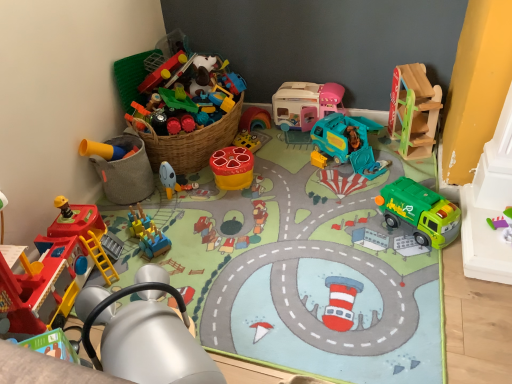
Question: Considering the relative sizes of green plastic garbage truck at lower right, which appears as the second toy when viewed from the right, and wooden slide at upper right, marked as the 1th toy in a right-to-left arrangement, in the image provided, is green plastic garbage truck at lower right, which appears as the second toy when viewed from the right, thinner than wooden slide at upper right, marked as the 1th toy in a right-to-left arrangement,?

Choices:
 (A) no
 (B) yes

Answer: (B)

Question: Can you confirm if green plastic garbage truck at lower right, which is the 8th toy in left-to-right order, is smaller than wooden slide at upper right, marked as the ninth toy in a left-to-right arrangement?

Choices:
 (A) no
 (B) yes

Answer: (B)

Question: From the image's perspective, is green plastic garbage truck at lower right, which is the 8th toy in left-to-right order, on top of wooden slide at upper right, marked as the ninth toy in a left-to-right arrangement?

Choices:
 (A) no
 (B) yes

Answer: (A)

Question: Is green plastic garbage truck at lower right, which appears as the second toy when viewed from the right, not near wooden slide at upper right, marked as the 1th toy in a right-to-left arrangement?

Choices:
 (A) no
 (B) yes

Answer: (A)

Question: Can you confirm if green plastic garbage truck at lower right, which is the 8th toy in left-to-right order, is bigger than wooden slide at upper right, marked as the ninth toy in a left-to-right arrangement?

Choices:
 (A) yes
 (B) no

Answer: (B)

Question: From a real-world perspective, is yellow matte bucket at lower left, the first toy in the left-to-right sequence, physically located above or below blue plastic train at center, acting as the 8th toy starting from the right?

Choices:
 (A) below
 (B) above

Answer: (B)

Question: Is yellow matte bucket at lower left, the first toy in the left-to-right sequence, bigger or smaller than blue plastic train at center, which appears as the 2th toy when viewed from the left?

Choices:
 (A) big
 (B) small

Answer: (A)

Question: Based on their positions, is yellow matte bucket at lower left, the 9th toy when ordered from right to left, located to the left or right of blue plastic train at center, acting as the 8th toy starting from the right?

Choices:
 (A) right
 (B) left

Answer: (B)

Question: From the image's perspective, is yellow matte bucket at lower left, the first toy in the left-to-right sequence, positioned above or below blue plastic train at center, which appears as the 2th toy when viewed from the left?

Choices:
 (A) above
 (B) below

Answer: (A)

Question: Is yellow matte bucket at lower left, the first toy in the left-to-right sequence, wider or thinner than teal plastic garbage truck at center, marked as the 3th toy in a right-to-left arrangement?

Choices:
 (A) wide
 (B) thin

Answer: (B)

Question: Based on their sizes in the image, would you say yellow matte bucket at lower left, the first toy in the left-to-right sequence, is bigger or smaller than teal plastic garbage truck at center, marked as the 3th toy in a right-to-left arrangement?

Choices:
 (A) big
 (B) small

Answer: (B)

Question: From a real-world perspective, relative to teal plastic garbage truck at center, acting as the 7th toy starting from the left, is yellow matte bucket at lower left, the first toy in the left-to-right sequence, vertically above or below?

Choices:
 (A) above
 (B) below

Answer: (A)

Question: Relative to teal plastic garbage truck at center, acting as the 7th toy starting from the left, is yellow matte bucket at lower left, the 9th toy when ordered from right to left, in front or behind?

Choices:
 (A) behind
 (B) front

Answer: (B)

Question: From a real-world perspective, is yellow matte bucket at lower left, the first toy in the left-to-right sequence, positioned above or below metallic yellow crane at lower left, which is counted as the 4th toy, starting from the left?

Choices:
 (A) above
 (B) below

Answer: (B)

Question: From the image's perspective, relative to metallic yellow crane at lower left, the sixth toy from the right, is yellow matte bucket at lower left, the first toy in the left-to-right sequence, above or below?

Choices:
 (A) above
 (B) below

Answer: (A)